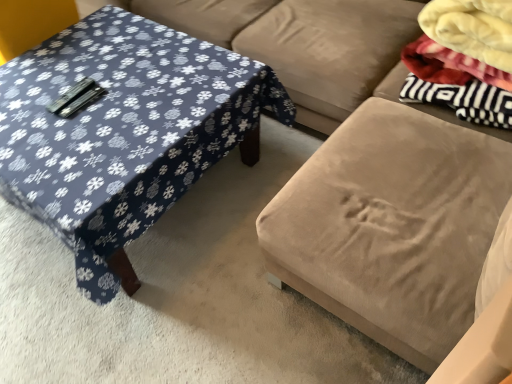
Question: Is blue fabric-covered table at left completely or partially outside of suede couch at center?

Choices:
 (A) yes
 (B) no

Answer: (A)

Question: From a real-world perspective, is blue fabric-covered table at left on suede couch at center?

Choices:
 (A) yes
 (B) no

Answer: (B)

Question: Can you confirm if blue fabric-covered table at left is shorter than suede couch at center?

Choices:
 (A) no
 (B) yes

Answer: (B)

Question: Is blue fabric-covered table at left at the right side of suede couch at center?

Choices:
 (A) no
 (B) yes

Answer: (A)

Question: Is blue fabric-covered table at left aimed at suede couch at center?

Choices:
 (A) yes
 (B) no

Answer: (B)

Question: In terms of size, does suede couch at center appear bigger or smaller than velvet beige ottoman at center?

Choices:
 (A) big
 (B) small

Answer: (A)

Question: Is suede couch at center in front of or behind velvet beige ottoman at center in the image?

Choices:
 (A) behind
 (B) front

Answer: (A)

Question: Considering the positions of suede couch at center and velvet beige ottoman at center in the image, is suede couch at center wider or thinner than velvet beige ottoman at center?

Choices:
 (A) wide
 (B) thin

Answer: (A)

Question: Considering the positions of suede couch at center and velvet beige ottoman at center in the image, is suede couch at center taller or shorter than velvet beige ottoman at center?

Choices:
 (A) short
 (B) tall

Answer: (A)

Question: From the image's perspective, is velvet beige ottoman at center located above or below blue fabric-covered table at left?

Choices:
 (A) below
 (B) above

Answer: (B)

Question: In the image, is velvet beige ottoman at center positioned in front of or behind blue fabric-covered table at left?

Choices:
 (A) behind
 (B) front

Answer: (B)

Question: Considering the positions of velvet beige ottoman at center and blue fabric-covered table at left in the image, is velvet beige ottoman at center bigger or smaller than blue fabric-covered table at left?

Choices:
 (A) big
 (B) small

Answer: (A)

Question: Is point (430, 322) positioned closer to the camera than point (54, 153)?

Choices:
 (A) closer
 (B) farther

Answer: (A)

Question: From a real-world perspective, is blue fabric-covered table at left positioned above or below fluffy white blanket at upper right?

Choices:
 (A) below
 (B) above

Answer: (A)

Question: Looking at the image, does blue fabric-covered table at left seem bigger or smaller compared to fluffy white blanket at upper right?

Choices:
 (A) small
 (B) big

Answer: (B)